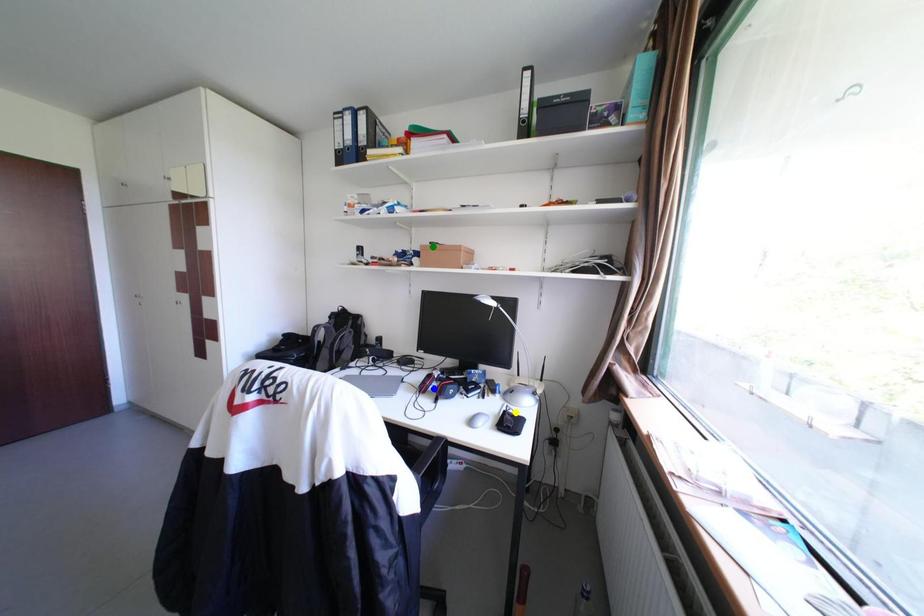
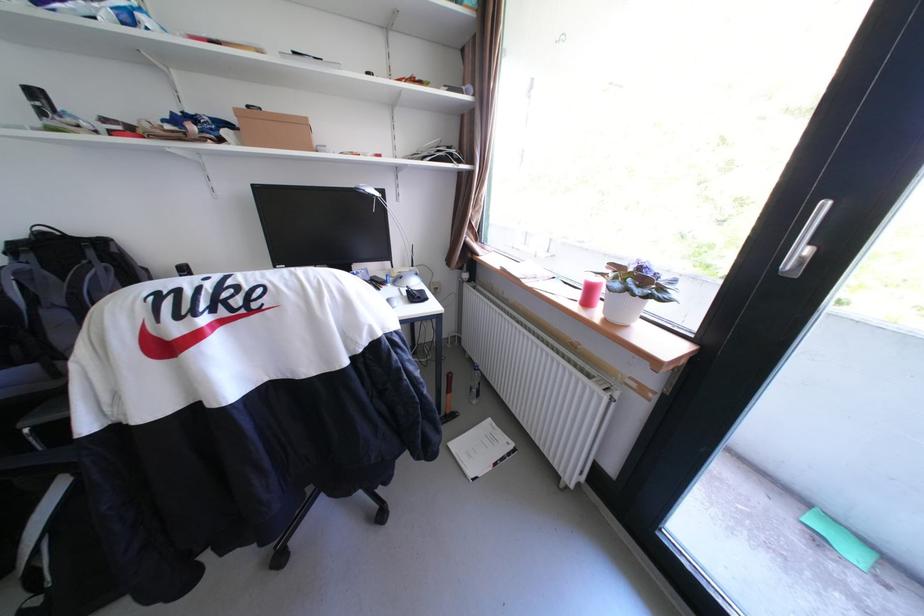
I am providing you with two images of the same scene from different viewpoints. Three points are marked in image1. Which point corresponds to a part or object that is occluded in image2?In image1, three points are marked. Which of them correspond to a part or object that is occluded in image2?Among the three points shown in image1, which one corresponds to a part or object that is no longer visible due to occlusion in image2?

Invisible in image2: blue point.